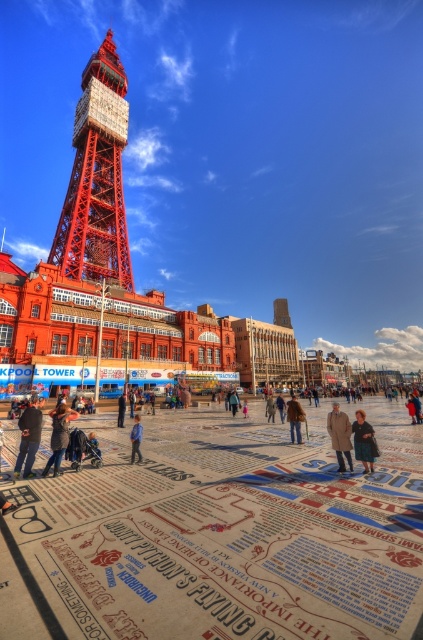
Question: Which object appears closest to the camera in this image?

Choices:
 (A) dark blue fabric coat at center
 (B) denim jacket at lower left
 (C) metallic red tower at center
 (D) beige mosaic tiles at center

Answer: (D)

Question: Does brown leather jacket at center have a greater width compared to blue denim jacket at center?

Choices:
 (A) yes
 (B) no

Answer: (A)

Question: Can you confirm if beige mosaic tiles at center is positioned above dark blue fabric coat at center?

Choices:
 (A) no
 (B) yes

Answer: (A)

Question: Which object appears farthest from the camera in this image?

Choices:
 (A) dark brown leather jacket at center
 (B) dark blue jeans at lower left
 (C) dark blue fabric coat at center

Answer: (A)

Question: Considering the real-world distances, which object is closest to the light brown leather coat at center?

Choices:
 (A) metallic red tower at center
 (B) dark blue fabric coat at center

Answer: (B)

Question: Is beige mosaic tiles at center to the right of dark blue jeans at lower left from the viewer's perspective?

Choices:
 (A) yes
 (B) no

Answer: (A)